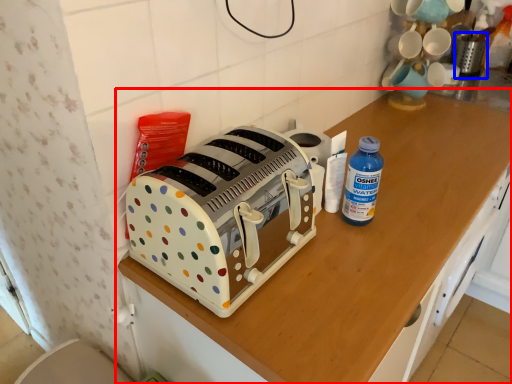
Question: Which point is closer to the camera, cabinetry (highlighted by a red box) or appliance (highlighted by a blue box)?

Choices:
 (A) cabinetry
 (B) appliance

Answer: (A)